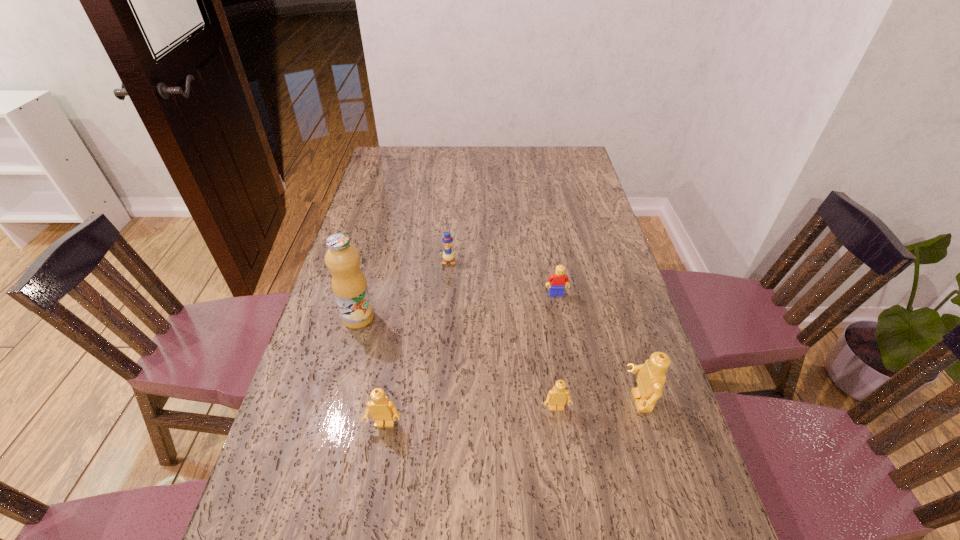
If equal spacing is desired by inserting an extra Lego among them, please point out a free spot for this new Lego. Please provide its 2D coordinates. Your answer should be formatted as a tuple, i.e. [(x, y)], where the tuple contains the x and y coordinates of a point satisfying the conditions above.

[(471, 416)]